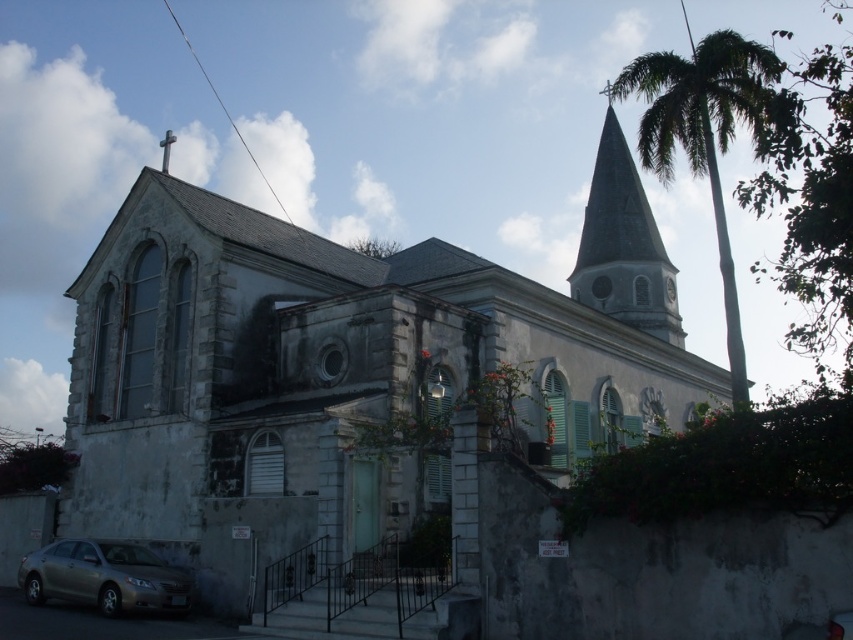
From the picture: Who is shorter, green leafy palm tree at upper right or metallic silver sedan at lower left?

With less height is metallic silver sedan at lower left.

You are a GUI agent. You are given a task and a screenshot of the screen. Output one action in this format:
    pyautogui.click(x=<x>, y=<y>)
    Task: Click on the green leafy palm tree at upper right
    
    Given the screenshot: What is the action you would take?
    pyautogui.click(x=703, y=134)

This screenshot has width=853, height=640. What are the coordinates of `green leafy palm tree at upper right` in the screenshot? It's located at (703, 134).

Can you confirm if green leafy palm tree at upper right is positioned below white stone clock at upper center?

No.

Can you confirm if green leafy palm tree at upper right is positioned to the right of white stone clock at upper center?

Yes, green leafy palm tree at upper right is to the right of white stone clock at upper center.

Is point (747, 99) less distant than point (671, 282)?

Yes, point (747, 99) is closer to viewer.

The width and height of the screenshot is (853, 640). I want to click on green leafy palm tree at upper right, so click(703, 134).

Between gray stone church at center and green leafy palm tree at upper right, which one has less height?

With less height is gray stone church at center.

Between point (224, 470) and point (743, 116), which one is positioned in front?

Point (224, 470) is in front.

Is point (496, 358) positioned behind point (618, 76)?

No, (496, 358) is in front of (618, 76).

The width and height of the screenshot is (853, 640). Find the location of `gray stone church at center`. gray stone church at center is located at coordinates (345, 360).